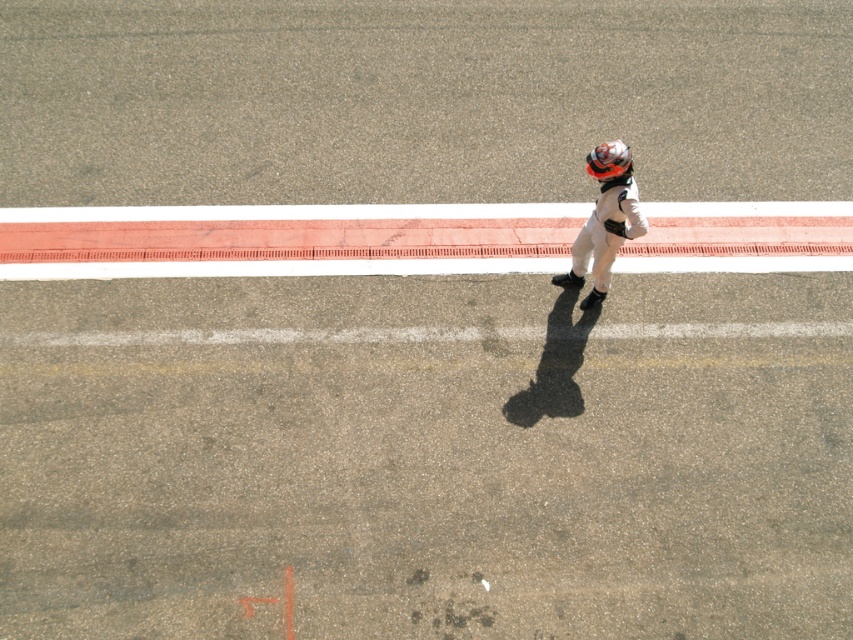
You are a photographer at the racetrack and want to capture a photo of the shiny orange helmet at upper right and the white smooth line at center. Which object is positioned higher in the image?

The shiny orange helmet at upper right is positioned higher in the image than the white smooth line at center, as the white smooth line at center is located below the helmet.

You are a race official checking the starting positions. The rule states that all helmets must be in front of the white smooth line at center. Is the shiny orange helmet at upper right compliant with this rule?

The shiny orange helmet at upper right is behind the white smooth line at center, so it does not comply with the rule requiring helmets to be in front of the white smooth line at center.